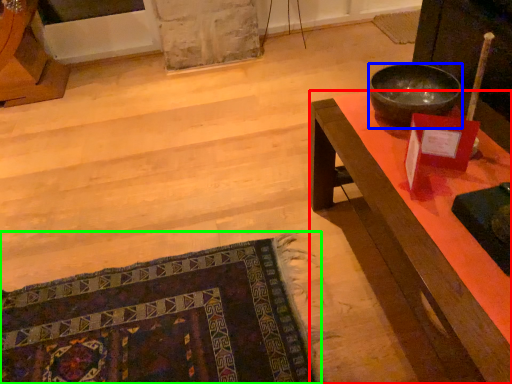
Question: Which object is positioned closest to desk (highlighted by a red box)? Select from bowl (highlighted by a blue box) and mat (highlighted by a green box).

Choices:
 (A) bowl
 (B) mat

Answer: (A)